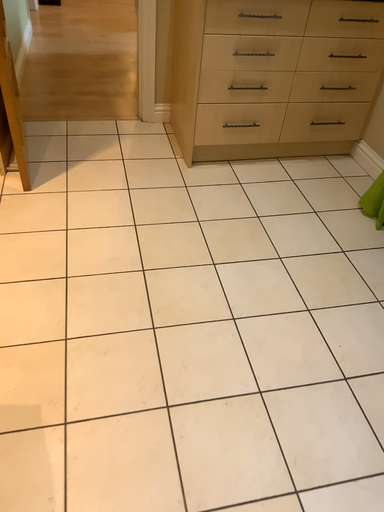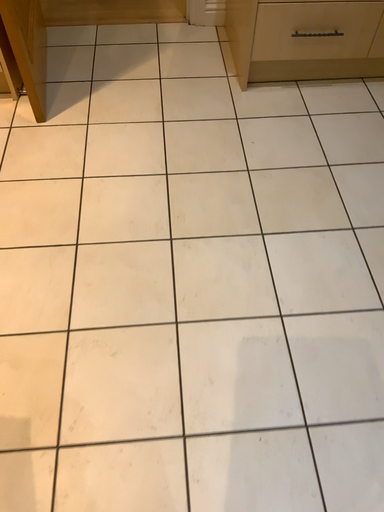
Question: Which way did the camera rotate in the video?

Choices:
 (A) rotated downward
 (B) rotated upward

Answer: (A)